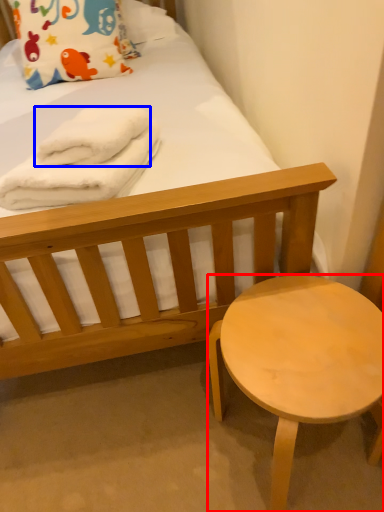
Question: Which object is further to the camera taking this photo, stool (highlighted by a red box) or bath towel (highlighted by a blue box)?

Choices:
 (A) stool
 (B) bath towel

Answer: (B)